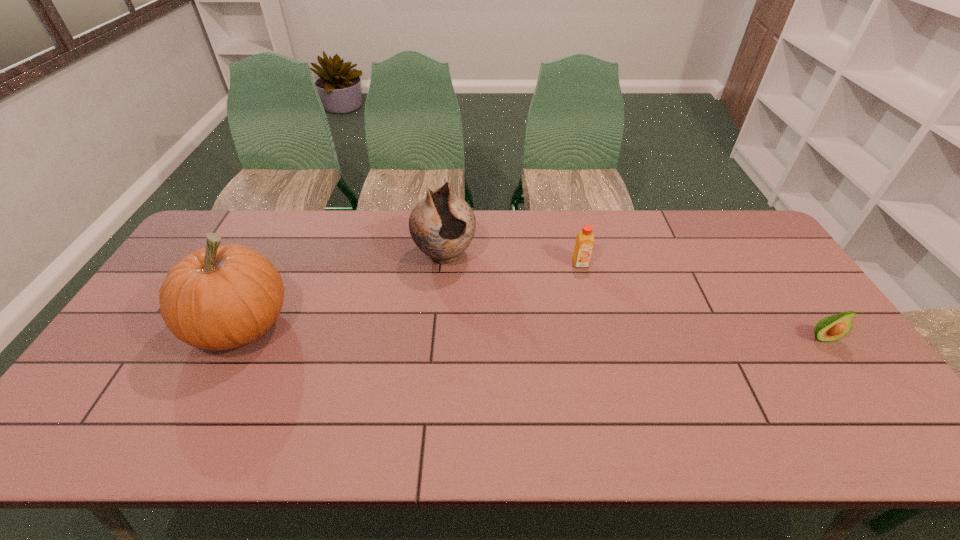
In order to click on free space between the avocado and the pottery in this screenshot , I will do `click(634, 296)`.

I want to click on vacant area that lies between the third object from left to right and the pumpkin, so click(411, 294).

The image size is (960, 540). What are the coordinates of `vacant area between the leftmost object and the second object from left to right` in the screenshot? It's located at (343, 290).

Locate which object is the closest to the second object from left to right. Please provide its 2D coordinates. Your answer should be formatted as a tuple, i.e. [(x, y)], where the tuple contains the x and y coordinates of a point satisfying the conditions above.

[(221, 297)]

Locate an element on the screen. Image resolution: width=960 pixels, height=540 pixels. object that stands as the closest to the pumpkin is located at coordinates click(x=442, y=225).